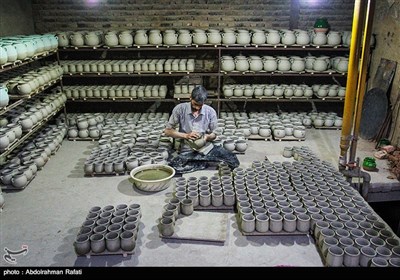
Where is `pots sitting on shelves`? The image size is (400, 280). pots sitting on shelves is located at coordinates (291, 85), (288, 66), (295, 35), (148, 32), (148, 60), (147, 98), (26, 115), (28, 84), (18, 54), (39, 148).